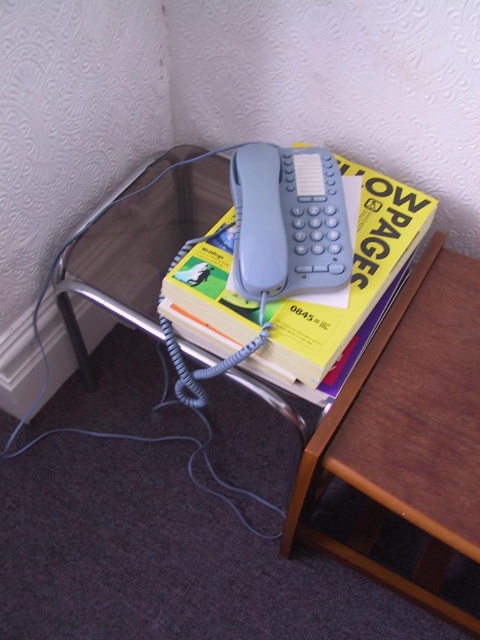
Question: Can you confirm if yellow paperbacks at center is positioned to the right of matte gray phone at center?

Choices:
 (A) no
 (B) yes

Answer: (B)

Question: Which of these objects is positioned farthest from the matte gray phone at center?

Choices:
 (A) yellow paperbacks at center
 (B) matte plastic phone at upper center

Answer: (B)

Question: Is the position of matte plastic phone at upper center less distant than that of matte gray phone at center?

Choices:
 (A) no
 (B) yes

Answer: (A)

Question: Which object is positioned closest to the yellow paperbacks at center?

Choices:
 (A) matte plastic phone at upper center
 (B) matte gray phone at center

Answer: (A)

Question: Considering the real-world distances, which object is closest to the matte plastic phone at upper center?

Choices:
 (A) yellow paperbacks at center
 (B) matte gray phone at center

Answer: (A)

Question: Is yellow paperbacks at center bigger than matte gray phone at center?

Choices:
 (A) no
 (B) yes

Answer: (B)